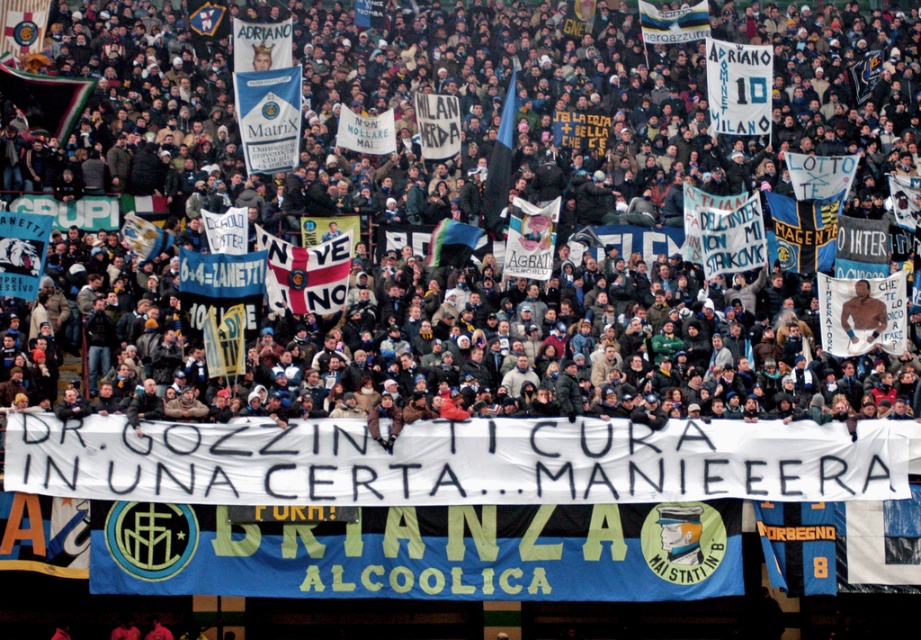
Can you confirm if white fabric banner at center is positioned above blue fabric flag at center?

Yes.

What do you see at coordinates (482, 179) in the screenshot?
I see `white fabric banner at center` at bounding box center [482, 179].

Which is behind, point (372, 168) or point (508, 97)?

The point (508, 97) is behind.

This screenshot has width=921, height=640. Find the location of `white fabric banner at center`. white fabric banner at center is located at coordinates (482, 179).

Which is behind, point (313, 269) or point (854, 305)?

Positioned behind is point (854, 305).

Describe the element at coordinates (305, 273) in the screenshot. This screenshot has height=640, width=921. I see `red and white striped flag at center` at that location.

Between point (286, 276) and point (855, 321), which one is positioned behind?

The point (855, 321) is more distant.

I want to click on red and white striped flag at center, so click(x=305, y=273).

Which is below, white fabric banner at center or blue and white striped flag at upper center?

Positioned lower is white fabric banner at center.

At what (x,y) coordinates should I click in order to perform the action: click on white fabric banner at center. Please return your answer as a coordinate pair (x, y). This screenshot has height=640, width=921. Looking at the image, I should click on (482, 179).